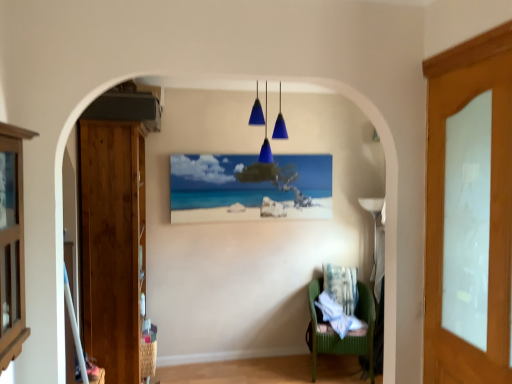
The image size is (512, 384). What are the coordinates of `white glass door at right, the 1th door from the front` in the screenshot? It's located at (490, 212).

The width and height of the screenshot is (512, 384). I want to click on blue glass pendant lights at center, so click(265, 128).

Looking at this image, considering the sizes of objects green fabric chair at lower right and blue glass pendant lights at center in the image provided, who is smaller, green fabric chair at lower right or blue glass pendant lights at center?

blue glass pendant lights at center.

From a real-world perspective, which object rests below the other?

green fabric chair at lower right, from a real-world perspective.

Is green fabric chair at lower right in front of or behind blue glass pendant lights at center in the image?

In the image, green fabric chair at lower right appears behind blue glass pendant lights at center.

Is green fabric chair at lower right at the left side of blue glass pendant lights at center?

No, green fabric chair at lower right is not to the left of blue glass pendant lights at center.

Considering the sizes of objects white glass door at right, the 1th door from the front, and fluffy white pillow at lower center in the image provided, who is bigger, white glass door at right, the 1th door from the front, or fluffy white pillow at lower center?

With larger size is white glass door at right, the 1th door from the front.

From the image's perspective, which one is positioned higher, white glass door at right, which ranks as the second door in back-to-front order, or fluffy white pillow at lower center?

white glass door at right, which ranks as the second door in back-to-front order, is shown above in the image.

Is white glass door at right, the 1th door from the front, wider than fluffy white pillow at lower center?

No, white glass door at right, the 1th door from the front, is not wider than fluffy white pillow at lower center.

Image resolution: width=512 pixels, height=384 pixels. I want to click on cabinetry on the right of wooden door at left, the 1th door from the left, so click(12, 243).

Measure the distance from wooden door at left, which is counted as the second door, starting from the front, to wooden cabinet at left.

A distance of 1.20 meters exists between wooden door at left, which is counted as the second door, starting from the front, and wooden cabinet at left.

Is point (114, 335) closer to viewer compared to point (12, 166)?

That is False.

Is fluffy white pillow at lower center oriented away from matte wooden picture frame at center?

fluffy white pillow at lower center does not have its back to matte wooden picture frame at center.

From a real-world perspective, relative to matte wooden picture frame at center, is fluffy white pillow at lower center vertically above or below?

fluffy white pillow at lower center is situated lower than matte wooden picture frame at center in the real world.

Is fluffy white pillow at lower center directly adjacent to matte wooden picture frame at center?

No, fluffy white pillow at lower center is not touching matte wooden picture frame at center.

Between fluffy white pillow at lower center and matte wooden picture frame at center, which one appears on the right side from the viewer's perspective?

fluffy white pillow at lower center is more to the right.

Considering the sizes of objects blue glass pendant lights at center and wooden door at left, the 1th door from the back, in the image provided, who is shorter, blue glass pendant lights at center or wooden door at left, the 1th door from the back,?

blue glass pendant lights at center is shorter.

Is blue glass pendant lights at center closer to the viewer compared to wooden door at left, acting as the second door starting from the right?

No, blue glass pendant lights at center is further to the viewer.

Considering the relative sizes of blue glass pendant lights at center and wooden door at left, which is counted as the second door, starting from the front, in the image provided, is blue glass pendant lights at center bigger than wooden door at left, which is counted as the second door, starting from the front,?

Incorrect, blue glass pendant lights at center is not larger than wooden door at left, which is counted as the second door, starting from the front.

Considering the relative sizes of white glass door at right, which is the second door in left-to-right order, and wooden door at left, acting as the second door starting from the right, in the image provided, is white glass door at right, which is the second door in left-to-right order, bigger than wooden door at left, acting as the second door starting from the right,?

Actually, white glass door at right, which is the second door in left-to-right order, might be smaller than wooden door at left, acting as the second door starting from the right.

Which object is positioned more to the left, white glass door at right, which ranks as the second door in back-to-front order, or wooden door at left, the 1th door from the back?

wooden door at left, the 1th door from the back, is more to the left.

Locate an element on the screen. This screenshot has width=512, height=384. door that is in front of the wooden door at left, acting as the second door starting from the right is located at coordinates (490, 212).

Considering the sizes of objects white glass door at right, which ranks as the second door in back-to-front order, and wooden door at left, acting as the second door starting from the right, in the image provided, who is taller, white glass door at right, which ranks as the second door in back-to-front order, or wooden door at left, acting as the second door starting from the right,?

Standing taller between the two is wooden door at left, acting as the second door starting from the right.

From the image's perspective, which object appears higher, blue glass pendant lights at center or green fabric chair at lower right?

From the image's view, blue glass pendant lights at center is above.

From a real-world perspective, is blue glass pendant lights at center positioned under green fabric chair at lower right based on gravity?

No, from a real-world perspective, blue glass pendant lights at center is not below green fabric chair at lower right.

Could you tell me if blue glass pendant lights at center is facing green fabric chair at lower right?

No, blue glass pendant lights at center is not aimed at green fabric chair at lower right.

Find the location of a particular element. This screenshot has height=384, width=512. chair behind the blue glass pendant lights at center is located at coordinates (346, 335).

You are a GUI agent. You are given a task and a screenshot of the screen. Output one action in this format:
    pyautogui.click(x=<x>, y=<y>)
    Task: Click on the door that is the 2nd one when counting upward from the fluffy white pillow at lower center (from the image's perspective)
    This screenshot has width=512, height=384.
    Given the screenshot: What is the action you would take?
    pyautogui.click(x=490, y=212)

Looking at the image, which one is located closer to white glass door at right, which ranks as the second door in back-to-front order, matte wooden picture frame at center or wooden door at left, the 1th door from the back?

Based on the image, wooden door at left, the 1th door from the back, appears to be nearer to white glass door at right, which ranks as the second door in back-to-front order.

Based on their spatial positions, is fluffy white pillow at lower center or blue glass pendant lights at center further from matte wooden picture frame at center?

fluffy white pillow at lower center is further to matte wooden picture frame at center.

Which object lies nearer to the anchor point wooden cabinet at left, white glass door at right, which is counted as the 1th door, starting from the right, or matte wooden picture frame at center?

Among the two, white glass door at right, which is counted as the 1th door, starting from the right, is located nearer to wooden cabinet at left.

Looking at the image, which one is located closer to wooden door at left, the 1th door from the back, blue glass pendant lights at center or fluffy white pillow at lower center?

blue glass pendant lights at center lies closer to wooden door at left, the 1th door from the back, than the other object.

Looking at this image, looking at the image, which one is located further to white glass door at right, the 1th door from the front, green fabric chair at lower right or wooden door at left, the 1th door from the back?

Among the two, wooden door at left, the 1th door from the back, is located further to white glass door at right, the 1th door from the front.

Considering their positions, is blue glass pendant lights at center positioned further to wooden cabinet at left than wooden door at left, the 1th door from the back?

blue glass pendant lights at center is positioned further to the anchor wooden cabinet at left.

Which object lies further to the anchor point matte wooden picture frame at center, wooden cabinet at left or wooden door at left, the 1th door from the back?

wooden cabinet at left lies further to matte wooden picture frame at center than the other object.

When comparing their distances from blue glass pendant lights at center, does matte wooden picture frame at center or wooden cabinet at left seem further?

Among the two, wooden cabinet at left is located further to blue glass pendant lights at center.

At what (x,y) coordinates should I click in order to perform the action: click on light fixture between wooden cabinet at left and fluffy white pillow at lower center in the front-back direction. Please return your answer as a coordinate pair (x, y). The height and width of the screenshot is (384, 512). Looking at the image, I should click on 265,128.

You are a GUI agent. You are given a task and a screenshot of the screen. Output one action in this format:
    pyautogui.click(x=<x>, y=<y>)
    Task: Click on the picture frame between wooden door at left, acting as the second door starting from the right, and blue glass pendant lights at center from left to right
    The image size is (512, 384).
    Given the screenshot: What is the action you would take?
    coord(249,187)

The image size is (512, 384). Identify the location of light fixture positioned between white glass door at right, which is counted as the 1th door, starting from the right, and green fabric chair at lower right from near to far. (265, 128).

I want to click on light fixture between white glass door at right, which is counted as the 1th door, starting from the right, and fluffy white pillow at lower center, along the z-axis, so [265, 128].